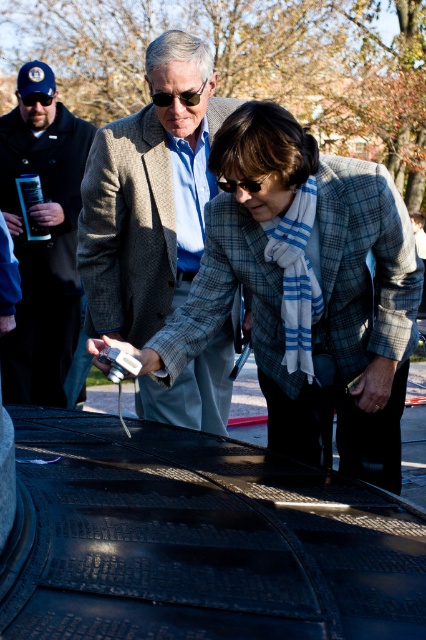
Which is in front, point (120, 193) or point (74, 330)?

Point (120, 193) is more forward.

Does brown woolen coat at center have a greater width compared to dark blue wool jacket at left?

Indeed, brown woolen coat at center has a greater width compared to dark blue wool jacket at left.

What do you see at coordinates (149, 195) in the screenshot?
I see `brown woolen coat at center` at bounding box center [149, 195].

Locate an element on the screen. This screenshot has height=640, width=426. brown woolen coat at center is located at coordinates (149, 195).

Which is more to the right, plaid wool jacket at center or dark blue wool jacket at left?

plaid wool jacket at center is more to the right.

Which of these two, plaid wool jacket at center or dark blue wool jacket at left, stands taller?

Standing taller between the two is dark blue wool jacket at left.

This screenshot has height=640, width=426. Describe the element at coordinates (319, 288) in the screenshot. I see `plaid wool jacket at center` at that location.

Where is `plaid wool jacket at center`? plaid wool jacket at center is located at coordinates (319, 288).

Is plaid wool jacket at center behind brown woolen coat at center?

No, plaid wool jacket at center is in front of brown woolen coat at center.

Does plaid wool jacket at center appear over brown woolen coat at center?

Actually, plaid wool jacket at center is below brown woolen coat at center.

Locate an element on the screen. The image size is (426, 640). plaid wool jacket at center is located at coordinates (319, 288).